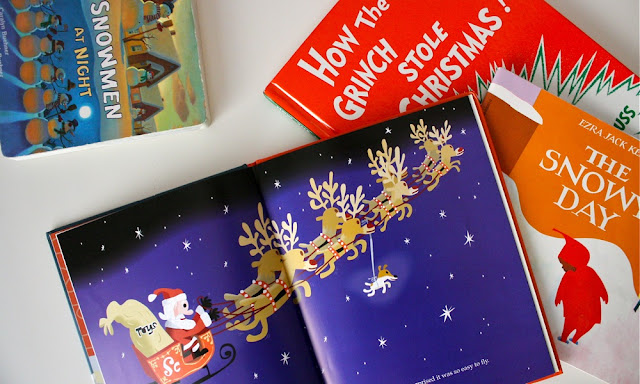
The width and height of the screenshot is (640, 384). Find the location of `book`. book is located at coordinates (157, 86).